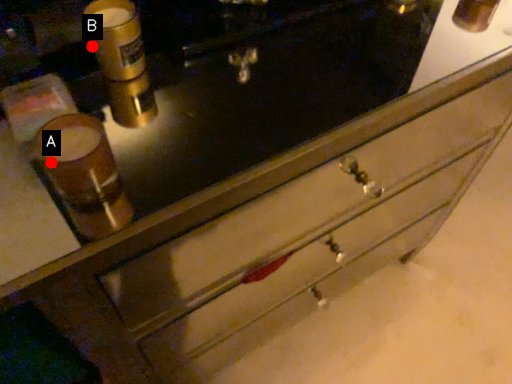
Question: Two points are circled on the image, labeled by A and B beside each circle. Which point is farther from the camera taking this photo?

Choices:
 (A) A is further
 (B) B is further

Answer: (B)